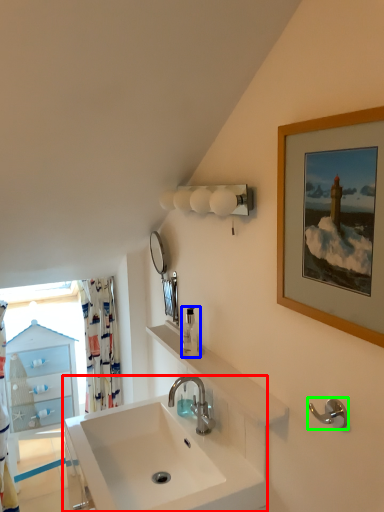
Question: Considering the real-world distances, which object is farthest from sink (highlighted by a red box)? soap dispenser (highlighted by a blue box) or towel bar (highlighted by a green box)?

Choices:
 (A) soap dispenser
 (B) towel bar

Answer: (B)